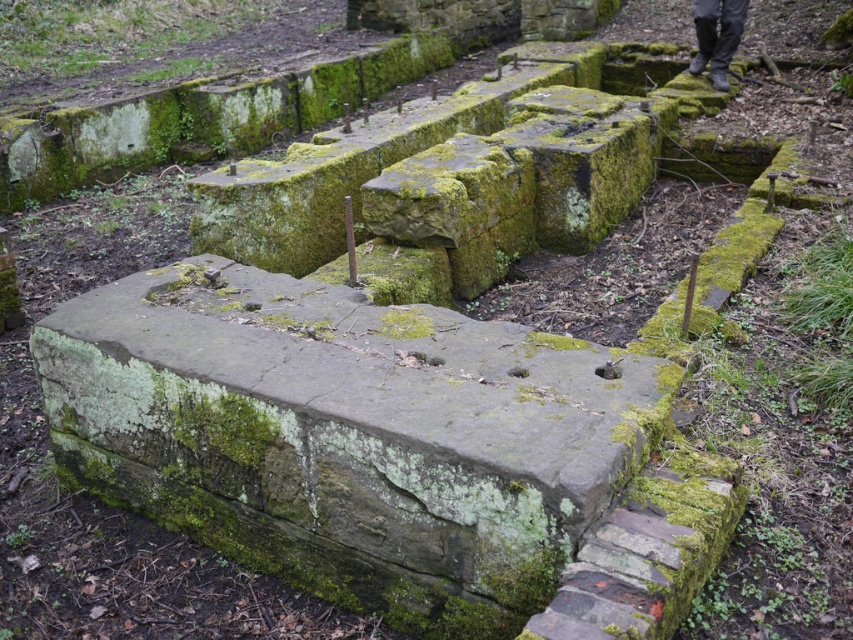
From the picture: You are standing at the base of the stone structures in the image. You notice two points marked on the stones. One is at coordinates point (521, 426) and the other at point (695, 16). Which point is nearer to you?

Point (521, 426) is closer to the viewer than point (695, 16).

You are a construction worker inspecting an old site. You notice the green mossy stone at center and the dark gray pants at upper right. Which object would require more material to repair due to its size?

The green mossy stone at center requires more material to repair because it has a larger size compared to the dark gray pants at upper right.

From the picture: You are a construction worker who needs to place a 10 feet long metal beam between the green mossy stone at center and the dark gray pants at upper right. Can you fit the beam between them without bending it?

The distance between the green mossy stone at center and the dark gray pants at upper right is 22.25 feet, so the 10 feet long metal beam can fit between them without bending since it is shorter than the available space.